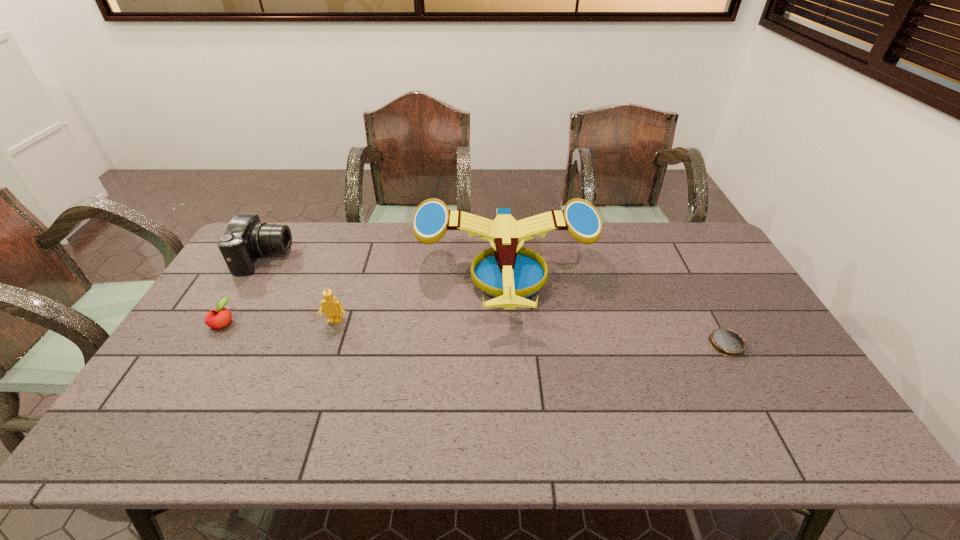
I want to click on free space at the near edge of the desktop, so click(250, 449).

At what (x,y) coordinates should I click in order to perform the action: click on vacant space at the left edge of the desktop. Please return your answer as a coordinate pair (x, y). Image resolution: width=960 pixels, height=540 pixels. Looking at the image, I should click on (152, 397).

At what (x,y) coordinates should I click in order to perform the action: click on free location at the right edge. Please return your answer as a coordinate pair (x, y). The height and width of the screenshot is (540, 960). Looking at the image, I should click on (760, 352).

Find the location of a particular element. The height and width of the screenshot is (540, 960). unoccupied area between the second shortest object and the drone is located at coordinates (364, 296).

Find the location of a particular element. free area in between the Lego and the apple is located at coordinates (279, 321).

Identify the location of vacant area that lies between the camera and the fourth object from left to right. (385, 265).

What are the coordinates of `vacant region between the third tallest object and the shortest object` in the screenshot? It's located at (531, 333).

At what (x,y) coordinates should I click in order to perform the action: click on unoccupied position between the rightmost object and the drone. Please return your answer as a coordinate pair (x, y). Looking at the image, I should click on (616, 308).

Locate an element on the screen. This screenshot has height=540, width=960. blank region between the rightmost object and the fourth object from left to right is located at coordinates coord(616,308).

This screenshot has width=960, height=540. I want to click on vacant space that is in between the second object from right to left and the camera, so click(x=385, y=265).